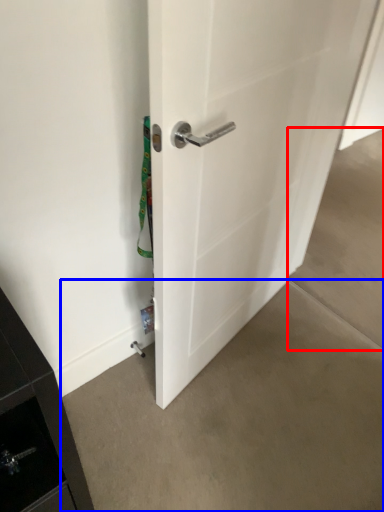
Question: Which point is further to the camera, concrete (highlighted by a red box) or concrete (highlighted by a blue box)?

Choices:
 (A) concrete
 (B) concrete

Answer: (A)